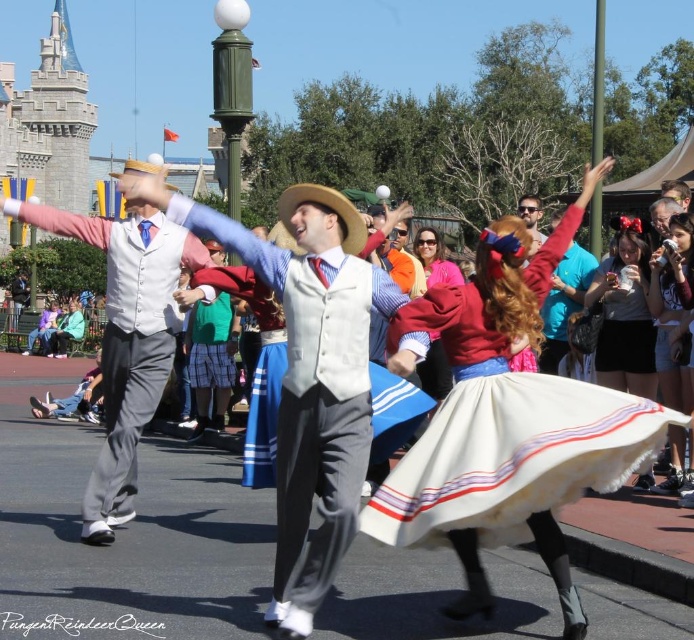
Find the location of a particular element. green plaid skirt at center is located at coordinates (210, 358).

Is green plaid skirt at center bigger than matte pink hoodie at center?

Correct, green plaid skirt at center is larger in size than matte pink hoodie at center.

Is point (230, 330) less distant than point (432, 259)?

That is True.

You are a GUI agent. You are given a task and a screenshot of the screen. Output one action in this format:
    pyautogui.click(x=<x>, y=<y>)
    Task: Click on the green plaid skirt at center
    Image resolution: width=694 pixels, height=640 pixels.
    Given the screenshot: What is the action you would take?
    pyautogui.click(x=210, y=358)

Does matte pink hoodie at center appear on the left side of beige fabric hat at upper center?

Correct, you'll find matte pink hoodie at center to the left of beige fabric hat at upper center.

Who is shorter, matte pink hoodie at center or beige fabric hat at upper center?

Standing shorter between the two is matte pink hoodie at center.

Image resolution: width=694 pixels, height=640 pixels. What do you see at coordinates (434, 259) in the screenshot? I see `matte pink hoodie at center` at bounding box center [434, 259].

Locate an element on the screen. The image size is (694, 640). matte pink hoodie at center is located at coordinates (434, 259).

Between point (625, 408) and point (425, 246), which one is positioned behind?

The point (425, 246) is more distant.

Is point (473, 401) behind point (428, 234)?

No, it is in front of (428, 234).

Which is in front, point (539, 323) or point (439, 269)?

Positioned in front is point (539, 323).

You are a GUI agent. You are given a task and a screenshot of the screen. Output one action in this format:
    pyautogui.click(x=<x>, y=<y>)
    Task: Click on the white cotton skirt at center
    
    Given the screenshot: What is the action you would take?
    pyautogui.click(x=502, y=419)